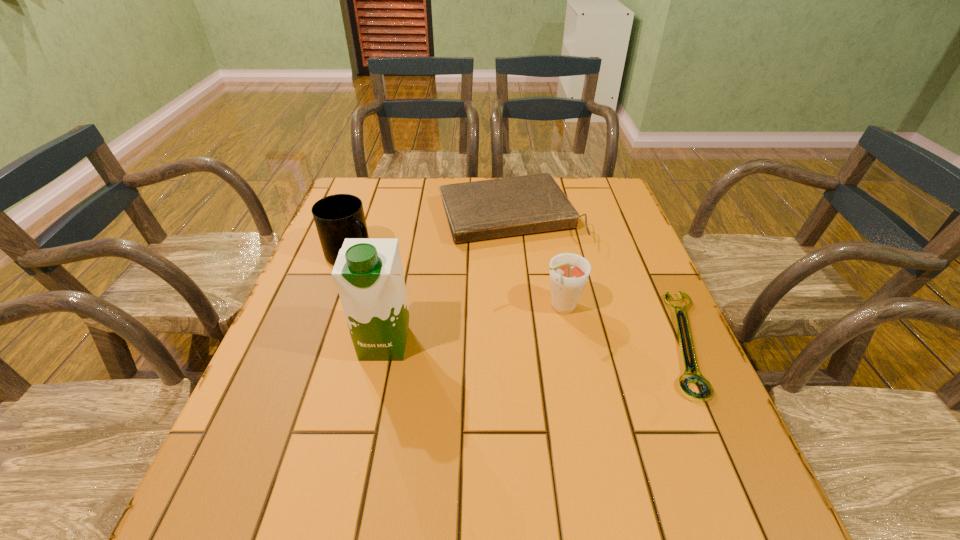
Locate an element on the screen. This screenshot has height=540, width=960. free spot between the root beer and the leftmost object is located at coordinates (457, 281).

This screenshot has width=960, height=540. Find the location of `unoccupied area between the fourth tallest object and the mug`. unoccupied area between the fourth tallest object and the mug is located at coordinates (430, 235).

Image resolution: width=960 pixels, height=540 pixels. I want to click on vacant space that's between the tallest object and the second shortest object, so click(446, 279).

In order to click on free spot between the root beer and the second shortest object in this screenshot , I will do `click(535, 261)`.

This screenshot has width=960, height=540. In order to click on unoccupied area between the wrench and the mug in this screenshot , I will do `click(518, 299)`.

You are a GUI agent. You are given a task and a screenshot of the screen. Output one action in this format:
    pyautogui.click(x=<x>, y=<y>)
    Task: Click on the free space between the tallest object and the wrench
    
    Given the screenshot: What is the action you would take?
    pyautogui.click(x=535, y=343)

Locate an element on the screen. the closest object relative to the second shortest object is located at coordinates (337, 217).

You are a GUI agent. You are given a task and a screenshot of the screen. Output one action in this format:
    pyautogui.click(x=<x>, y=<y>)
    Task: Click on the object that is the nearest to the root beer
    The height and width of the screenshot is (540, 960).
    Given the screenshot: What is the action you would take?
    pyautogui.click(x=697, y=378)

Identify the location of vacant region that satisfies the following two spatial constraints: 1. on the front side of the root beer; 2. on the right side of the second shortest object. (516, 308).

Identify the location of vacant region that satisfies the following two spatial constraints: 1. on the front side of the root beer; 2. on the right side of the shortest object. This screenshot has height=540, width=960. (568, 342).